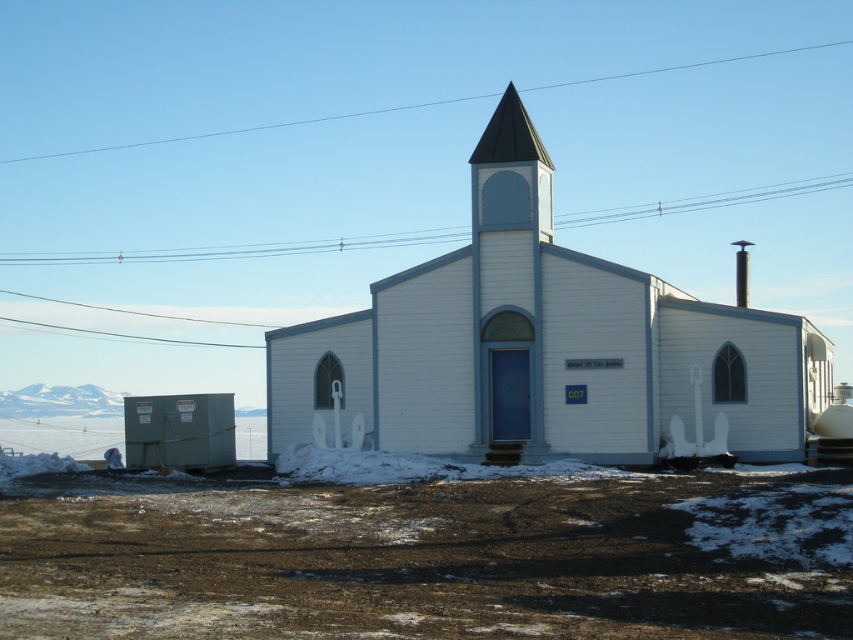
Who is higher up, white wood church at center or shiny dark gray spire at center?

shiny dark gray spire at center is above.

Which is in front, point (612, 445) or point (525, 124)?

Positioned in front is point (612, 445).

Is point (532, 150) in front of point (506, 138)?

Yes, point (532, 150) is closer to viewer.

Where is `white wood church at center`? The width and height of the screenshot is (853, 640). white wood church at center is located at coordinates (543, 342).